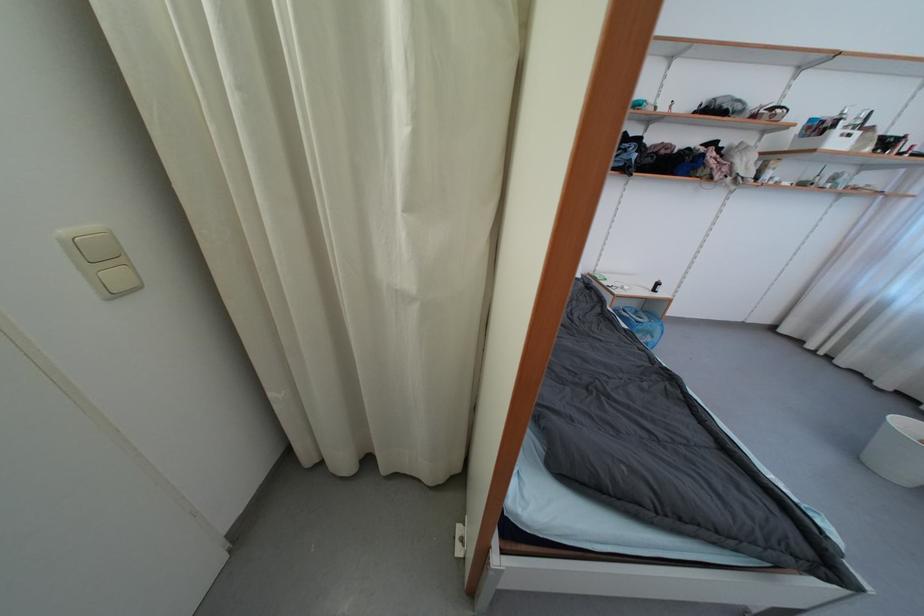
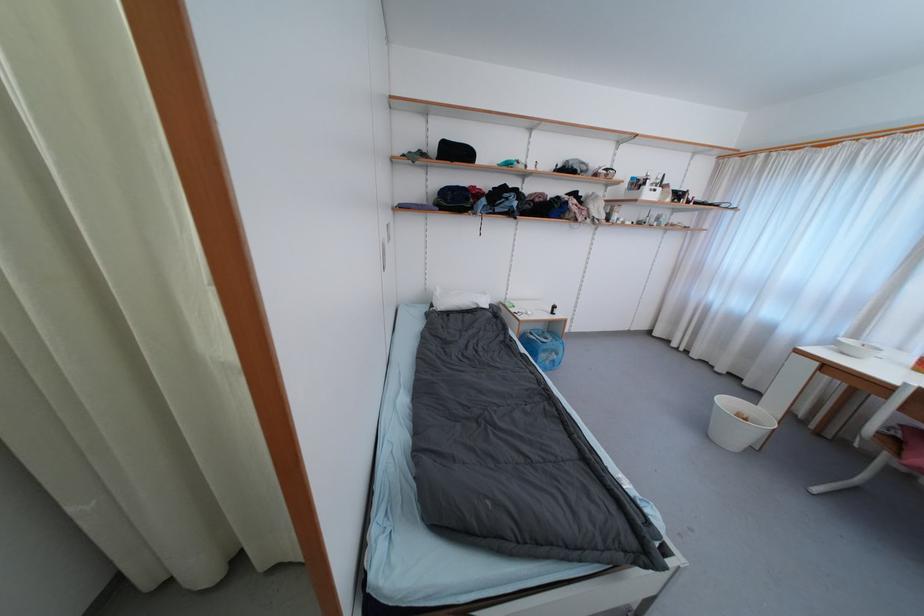
Find the pixel in the second image that matches [663,291] in the first image.

(560, 313)